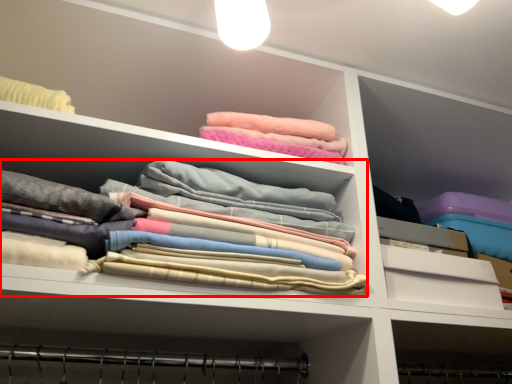
Question: Observing the image, what is the correct spatial positioning of clothing (annotated by the red box) in reference to drawer?

Choices:
 (A) left
 (B) right

Answer: (A)